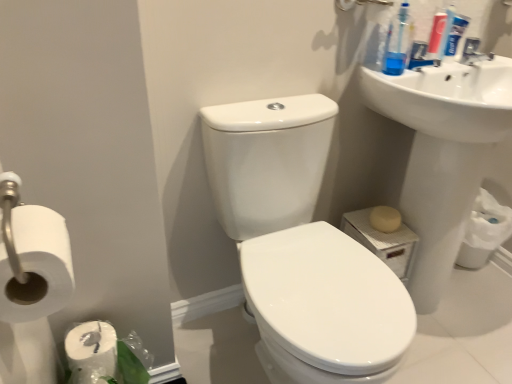
Question: From a real-world perspective, is white matte toilet paper at left, marked as the first toilet paper in a left-to-right arrangement, over beige matte soap at lower right?

Choices:
 (A) yes
 (B) no

Answer: (A)

Question: Can you confirm if white matte toilet paper at left, which ranks as the 2th toilet paper in right-to-left order, is wider than beige matte soap at lower right?

Choices:
 (A) yes
 (B) no

Answer: (A)

Question: From the image's perspective, is white matte toilet paper at left, which ranks as the 2th toilet paper in right-to-left order, on top of beige matte soap at lower right?

Choices:
 (A) yes
 (B) no

Answer: (A)

Question: Does white matte toilet paper at left, marked as the first toilet paper in a left-to-right arrangement, have a smaller size compared to beige matte soap at lower right?

Choices:
 (A) no
 (B) yes

Answer: (A)

Question: Is white matte toilet paper at left, which is the 1th toilet paper in front-to-back order, closer to the viewer compared to beige matte soap at lower right?

Choices:
 (A) yes
 (B) no

Answer: (A)

Question: Is white glossy toilet at center wider or thinner than blue plastic toothbrush at upper right, positioned as the second cleaning product in right-to-left order?

Choices:
 (A) thin
 (B) wide

Answer: (B)

Question: From a real-world perspective, relative to blue plastic toothbrush at upper right, positioned as the second cleaning product in right-to-left order, is white glossy toilet at center vertically above or below?

Choices:
 (A) below
 (B) above

Answer: (A)

Question: Is white glossy toilet at center inside or outside of blue plastic toothbrush at upper right, which is counted as the 1th cleaning product, starting from the left?

Choices:
 (A) outside
 (B) inside

Answer: (A)

Question: Does point (329, 294) appear closer or farther from the camera than point (393, 66)?

Choices:
 (A) closer
 (B) farther

Answer: (A)

Question: Considering the positions of white matte toilet paper at lower right, the 1th toilet paper viewed from the back, and blue plastic toothpaste tube at upper right, the second cleaning product positioned from the left, in the image, is white matte toilet paper at lower right, the 1th toilet paper viewed from the back, bigger or smaller than blue plastic toothpaste tube at upper right, the second cleaning product positioned from the left,?

Choices:
 (A) small
 (B) big

Answer: (B)

Question: From a real-world perspective, is white matte toilet paper at lower right, which is the second toilet paper from front to back, physically located above or below blue plastic toothpaste tube at upper right, acting as the first cleaning product starting from the right?

Choices:
 (A) below
 (B) above

Answer: (A)

Question: Relative to blue plastic toothpaste tube at upper right, the second cleaning product positioned from the left, is white matte toilet paper at lower right, the 1th toilet paper viewed from the back, in front or behind?

Choices:
 (A) behind
 (B) front

Answer: (A)

Question: Would you say white matte toilet paper at lower right, which is the second toilet paper from front to back, is inside or outside blue plastic toothpaste tube at upper right, the second cleaning product positioned from the left?

Choices:
 (A) outside
 (B) inside

Answer: (A)

Question: From a real-world perspective, is blue plastic toothpaste tube at upper right, the second cleaning product positioned from the left, above or below white glossy toilet at center?

Choices:
 (A) above
 (B) below

Answer: (A)

Question: From the image's perspective, relative to white glossy toilet at center, is blue plastic toothpaste tube at upper right, acting as the first cleaning product starting from the right, above or below?

Choices:
 (A) below
 (B) above

Answer: (B)